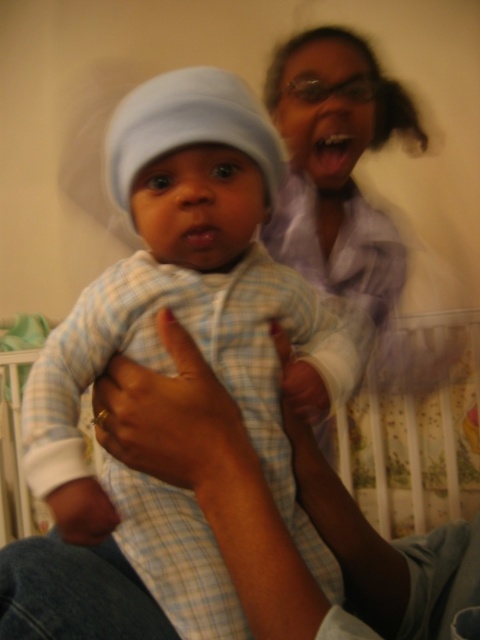
Based on the photo, looking at the image, there are two items with light blue plaid patterns. Which one is positioned higher between the light blue plaid onesie at center and the light blue plaid fabric at center?

The light blue plaid onesie at center is above the light blue plaid fabric at center, so the onesie is higher.

You are a photographer trying to capture the baby in focus. Since both the light blue plaid onesie at center and the light blue plaid fabric at center are in the frame, which one do you need to focus on if you want the item with the smaller width to be sharp?

The light blue plaid onesie at center has a lesser width compared to the light blue plaid fabric at center, so you should focus on the light blue plaid onesie at center to ensure it appears sharp.

You are taking a photo of the baby and need to focus on one of the two points in the image. Which point is closer to the camera, point (132,97) or point (464,428)?

Point (132,97) is closer to the camera than point (464,428).